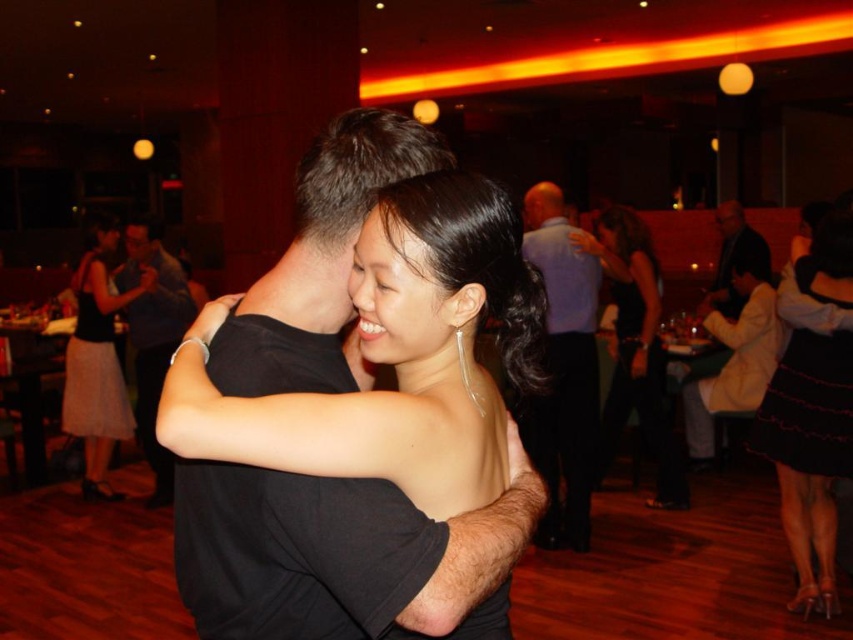
Between black satin dress at lower right and light pink textured skirt at left, which one has less height?

With less height is light pink textured skirt at left.

How distant is black satin dress at lower right from light pink textured skirt at left?

4.01 meters

Find the location of a particular element. The image size is (853, 640). black satin dress at lower right is located at coordinates (811, 406).

Find the location of a particular element. The width and height of the screenshot is (853, 640). light blue shirt at upper right is located at coordinates (563, 369).

Is light blue shirt at upper right wider than black satin dress at center?

No.

This screenshot has height=640, width=853. I want to click on light blue shirt at upper right, so click(x=563, y=369).

In the scene shown: Does black satin dress at lower right appear under black satin dress at center?

Yes.

Looking at this image, does black satin dress at lower right appear over black satin dress at center?

Actually, black satin dress at lower right is below black satin dress at center.

Who is more distant from viewer, (807, 288) or (643, 246)?

Point (643, 246)

Where is `black satin dress at lower right`? The image size is (853, 640). black satin dress at lower right is located at coordinates (811, 406).